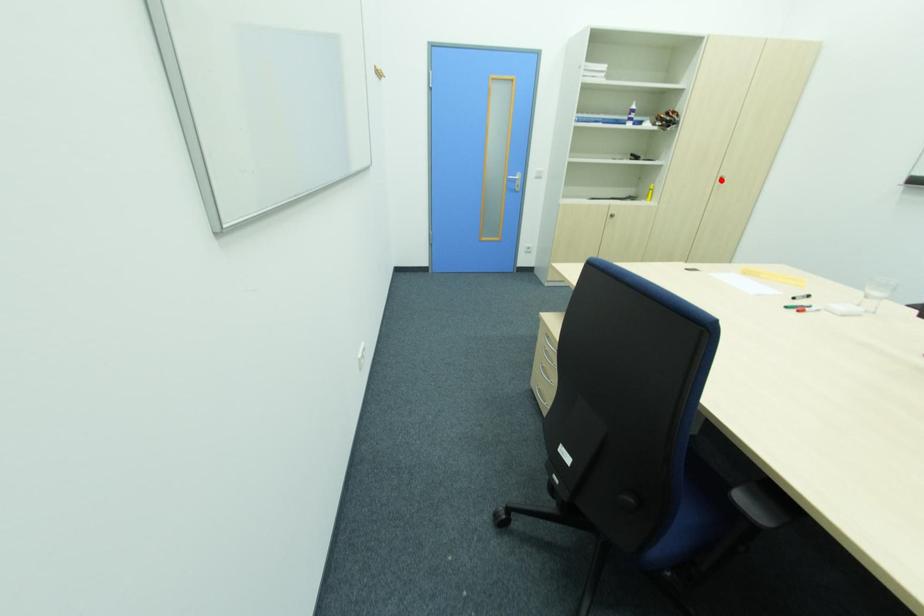
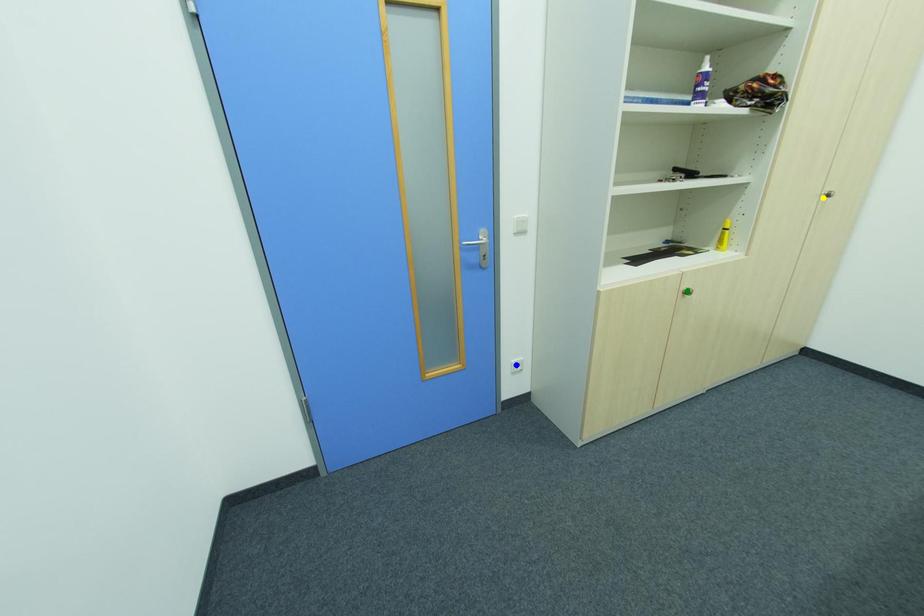
Question: I am providing you with two images of the same scene from different viewpoints. A red point is marked on the first image. You are given multiple points on the second image. Which point in image 2 represents the same 3d spot as the red point in image 1?

Choices:
 (A) green point
 (B) yellow point
 (C) blue point

Answer: (B)